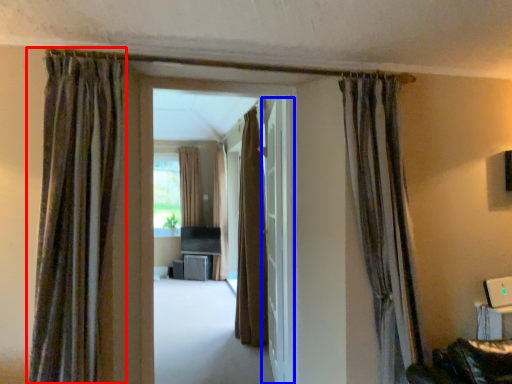
Question: Which object is closer to the camera taking this photo, curtain (highlighted by a red box) or door (highlighted by a blue box)?

Choices:
 (A) curtain
 (B) door

Answer: (A)